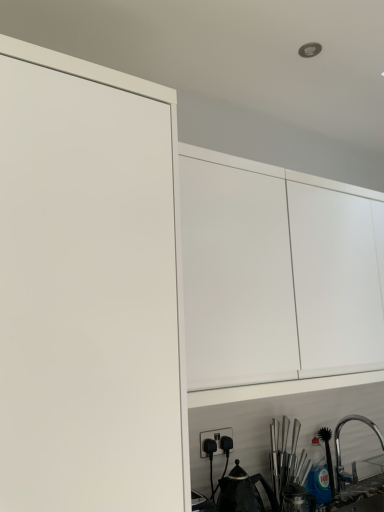
Question: Is point (200, 311) closer or farther from the camera than point (336, 435)?

Choices:
 (A) closer
 (B) farther

Answer: (A)

Question: Is white matte cabinet at upper center inside or outside of satin nickel faucet at lower right?

Choices:
 (A) outside
 (B) inside

Answer: (A)

Question: Considering the real-world distances, which object is closest to the white matte cabinet at upper center?

Choices:
 (A) black matte tea pot at lower center
 (B) satin nickel faucet at lower right
 (C) black plastic electric outlet at lower center

Answer: (C)

Question: Estimate the real-world distances between objects in this image. Which object is farther from the black plastic electric outlet at lower center?

Choices:
 (A) black matte tea pot at lower center
 (B) white matte cabinet at upper center
 (C) satin nickel faucet at lower right

Answer: (C)